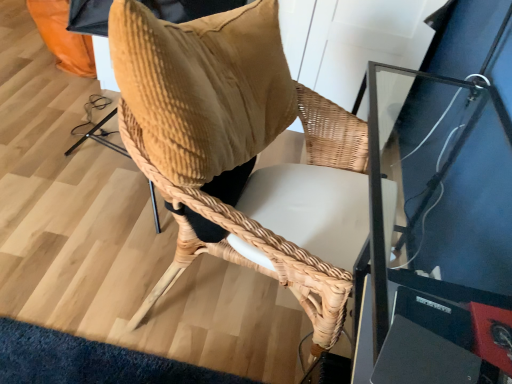
Question: Should I look upward or downward to see velvet brown bean bag chair at center?

Choices:
 (A) down
 (B) up

Answer: (B)

Question: Does velvet brown bean bag chair at center have a lesser height compared to woven wood chair at center?

Choices:
 (A) no
 (B) yes

Answer: (B)

Question: Can you confirm if velvet brown bean bag chair at center is smaller than woven wood chair at center?

Choices:
 (A) yes
 (B) no

Answer: (A)

Question: Is velvet brown bean bag chair at center oriented away from woven wood chair at center?

Choices:
 (A) yes
 (B) no

Answer: (B)

Question: Can you confirm if velvet brown bean bag chair at center is positioned to the left of woven wood chair at center?

Choices:
 (A) yes
 (B) no

Answer: (A)

Question: Considering the relative sizes of velvet brown bean bag chair at center and woven wood chair at center in the image provided, is velvet brown bean bag chair at center wider than woven wood chair at center?

Choices:
 (A) no
 (B) yes

Answer: (A)

Question: Is there a large distance between velvet brown bean bag chair at center and woven wood chair at center?

Choices:
 (A) yes
 (B) no

Answer: (B)

Question: Considering the relative sizes of woven wood chair at center and velvet brown bean bag chair at center in the image provided, is woven wood chair at center bigger than velvet brown bean bag chair at center?

Choices:
 (A) no
 (B) yes

Answer: (B)

Question: Can you confirm if woven wood chair at center is shorter than velvet brown bean bag chair at center?

Choices:
 (A) yes
 (B) no

Answer: (B)

Question: Is woven wood chair at center looking in the opposite direction of velvet brown bean bag chair at center?

Choices:
 (A) no
 (B) yes

Answer: (A)

Question: Is woven wood chair at center oriented towards velvet brown bean bag chair at center?

Choices:
 (A) yes
 (B) no

Answer: (B)

Question: Is velvet brown bean bag chair at center located within woven wood chair at center?

Choices:
 (A) no
 (B) yes

Answer: (B)

Question: Considering the relative sizes of woven wood chair at center and velvet brown bean bag chair at center in the image provided, is woven wood chair at center smaller than velvet brown bean bag chair at center?

Choices:
 (A) yes
 (B) no

Answer: (B)

Question: Looking at their shapes, would you say woven wood chair at center is wider or thinner than velvet brown bean bag chair at center?

Choices:
 (A) thin
 (B) wide

Answer: (B)